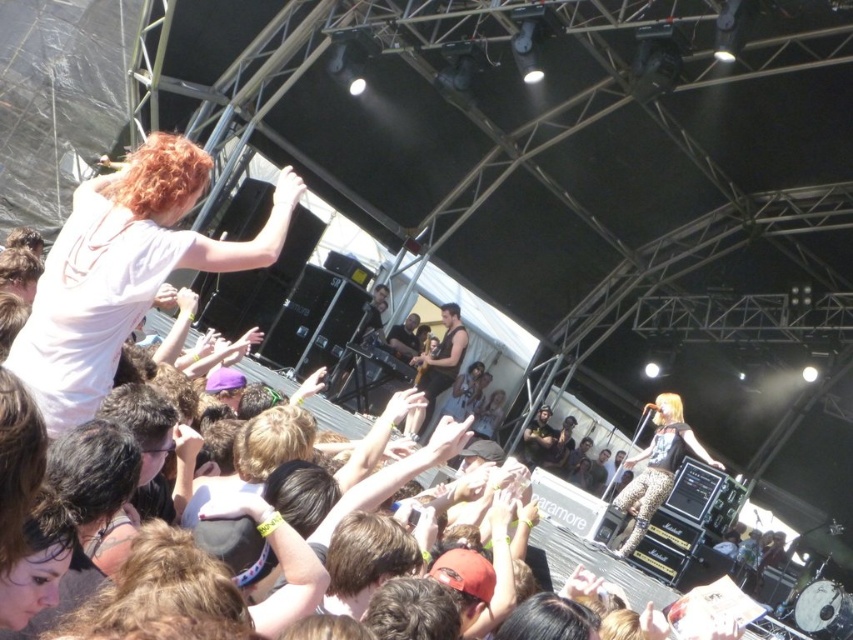
You are standing at the center of the concert venue and want to take a photo of the two points mentioned. Which point, point (x=689, y=440) or point (x=404, y=337), is closer to your camera lens?

Point (x=689, y=440) is closer to the camera than point (x=404, y=337), so it will appear larger in your photo.